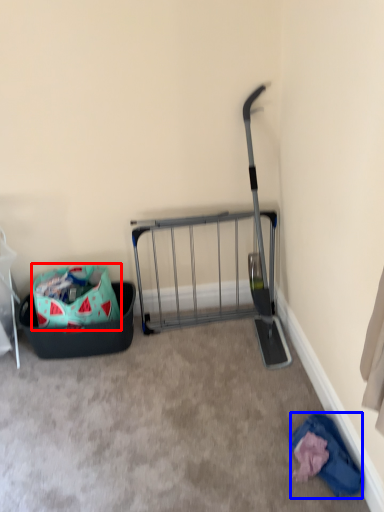
Question: Which point is closer to the camera, bag (highlighted by a red box) or clothing (highlighted by a blue box)?

Choices:
 (A) bag
 (B) clothing

Answer: (B)